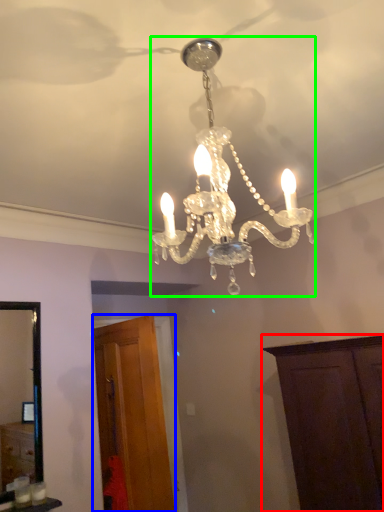
Question: Considering the real-world distances, which object is farthest from cabinetry (highlighted by a red box)? cabinetry (highlighted by a blue box) or lamp (highlighted by a green box)?

Choices:
 (A) cabinetry
 (B) lamp

Answer: (B)